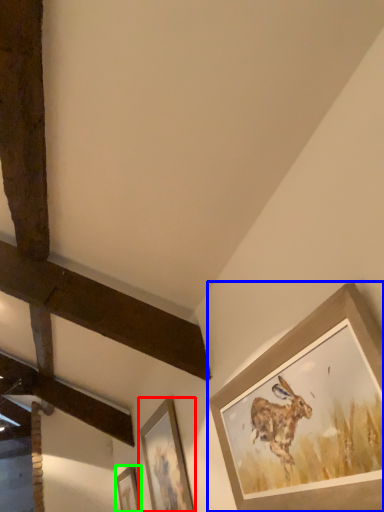
Question: Which object is positioned farthest from picture frame (highlighted by a red box)? Select from picture frame (highlighted by a blue box) and picture frame (highlighted by a green box).

Choices:
 (A) picture frame
 (B) picture frame

Answer: (A)